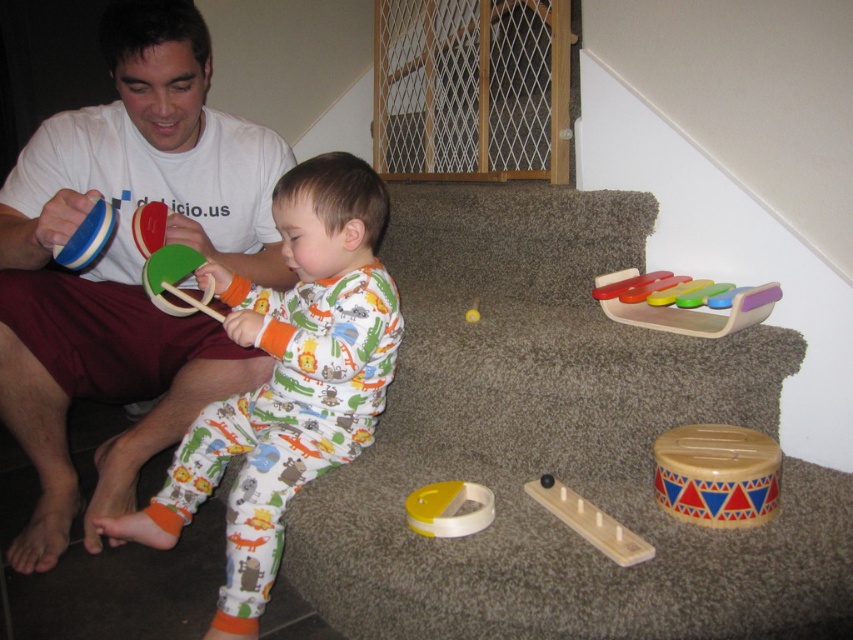
You are a parent trying to organize the toys after playtime. You need to place the wooden xylophone at upper right and the yellow matte ball at center into a storage bin. Which toy should you pick up first to avoid blocking the other?

You should pick up the wooden xylophone at upper right first because it is positioned over the yellow matte ball at center, so removing it first will prevent blocking access to the ball.

You are a delivery robot trying to place a small package on the yellow matte ring at center. According to the coordinates provided, where exactly should you position the package?

The yellow matte ring at center is located at point (450, 508), so you should position the package precisely at those coordinates to place it on the yellow matte ring at center.

You are a parent trying to organize the toys on the staircase. The wooden xylophone at upper right and the yellow matte ball at center are in the way of the stairs. How far apart are these two toys from each other?

The wooden xylophone at upper right is 14.67 inches away from the yellow matte ball at center.